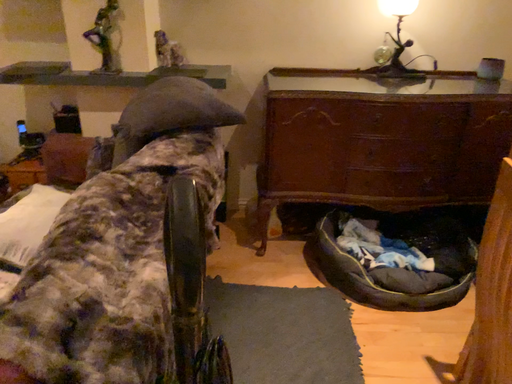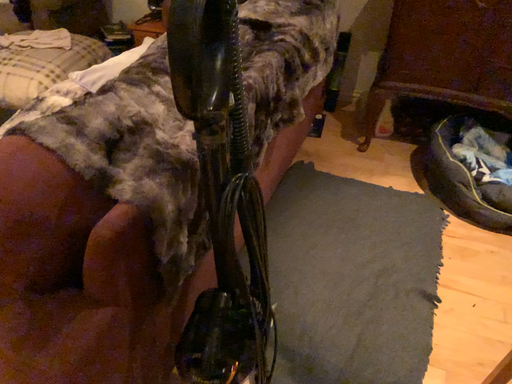
Question: How did the camera likely rotate when shooting the video?

Choices:
 (A) rotated left
 (B) rotated right

Answer: (A)